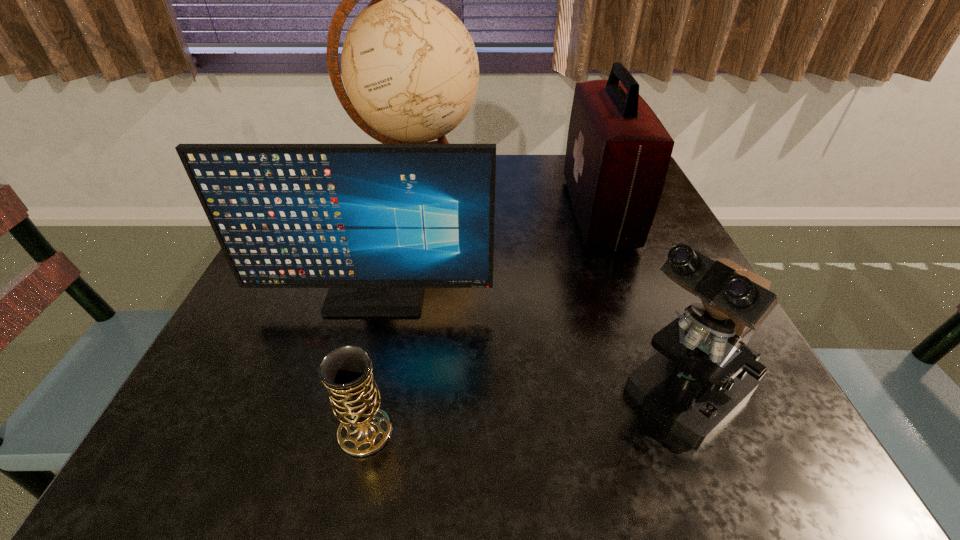
The width and height of the screenshot is (960, 540). Find the location of `vacant point that satisfies the following two spatial constraints: 1. on the surface of the tallest object; 2. on the screen side of the third farthest object`. vacant point that satisfies the following two spatial constraints: 1. on the surface of the tallest object; 2. on the screen side of the third farthest object is located at coordinates (394, 299).

You are a GUI agent. You are given a task and a screenshot of the screen. Output one action in this format:
    pyautogui.click(x=<x>, y=<y>)
    Task: Click on the vacant region that satisfies the following two spatial constraints: 1. on the surface of the tallest object; 2. on the right side of the shortest object
    This screenshot has height=540, width=960.
    Given the screenshot: What is the action you would take?
    pyautogui.click(x=365, y=431)

This screenshot has width=960, height=540. In order to click on free space that satisfies the following two spatial constraints: 1. on the screen side of the microscope; 2. on the right side of the computer monitor in this screenshot , I will do `click(349, 394)`.

This screenshot has width=960, height=540. I want to click on free point that satisfies the following two spatial constraints: 1. on the back side of the shortest object; 2. on the right side of the microscope, so click(373, 394).